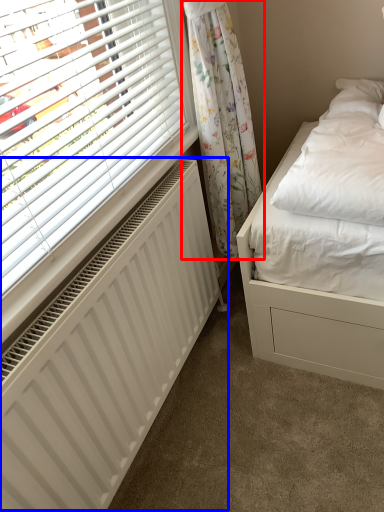
Question: Which of the following is the farthest to the observer, curtain (highlighted by a red box) or radiator (highlighted by a blue box)?

Choices:
 (A) curtain
 (B) radiator

Answer: (A)